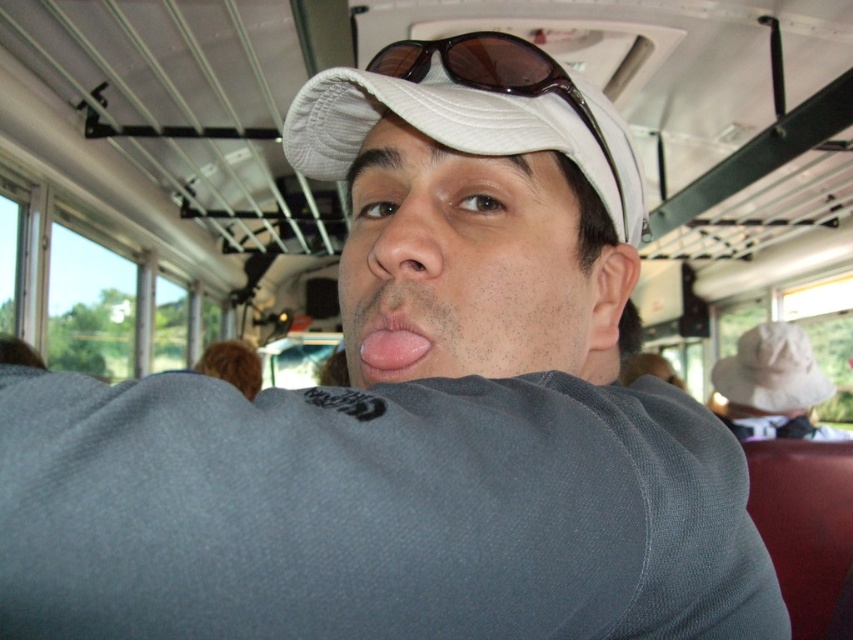
Question: Can you confirm if matte gray face at center is bigger than white fabric cap at center?

Choices:
 (A) yes
 (B) no

Answer: (B)

Question: Which point appears farthest from the camera in this image?

Choices:
 (A) (740, 353)
 (B) (421, 358)
 (C) (515, 92)
 (D) (433, 236)

Answer: (A)

Question: Which object is the farthest from the matte gray face at center?

Choices:
 (A) white fabric hat at upper center
 (B) matte skin nose at center
 (C) white fabric cap at center

Answer: (A)

Question: Which of the following is the closest to the observer?

Choices:
 (A) (778, 362)
 (B) (424, 248)

Answer: (B)

Question: Can you confirm if matte gray face at center is positioned above white fabric cap at center?

Choices:
 (A) no
 (B) yes

Answer: (A)

Question: Is matte skin nose at center above pink flesh at center?

Choices:
 (A) yes
 (B) no

Answer: (A)